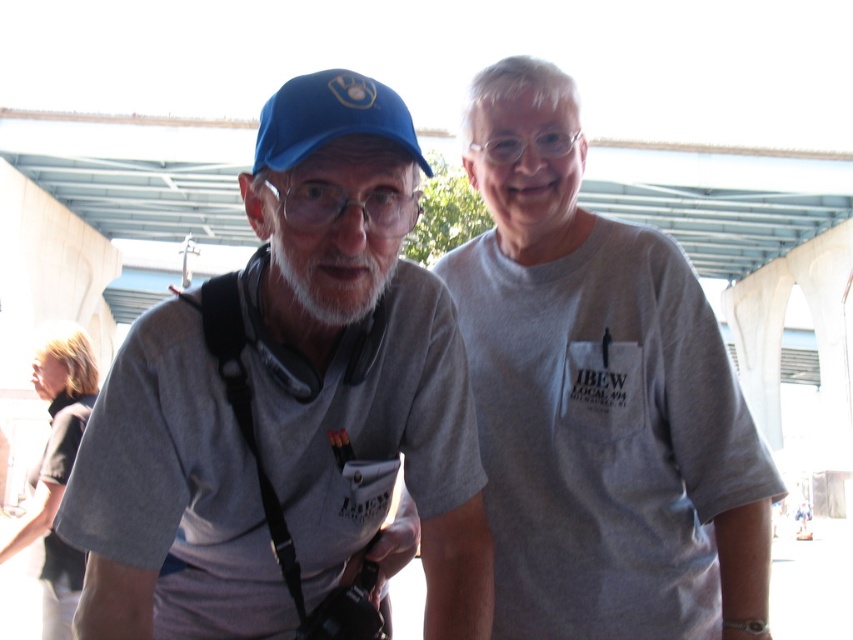
Question: Can you confirm if matte gray t-shirt at left is smaller than transparent plastic goggles at center?

Choices:
 (A) no
 (B) yes

Answer: (A)

Question: Which object appears farthest from the camera in this image?

Choices:
 (A) matte gray t-shirt at left
 (B) transparent plastic goggles at center
 (C) dark gray shirt at lower left

Answer: (C)

Question: Which of the following is the farthest from the observer?

Choices:
 (A) (314, 104)
 (B) (393, 204)
 (C) (65, 516)

Answer: (B)

Question: Does gray cotton t-shirt at center have a greater width compared to whitehairbeard at center?

Choices:
 (A) yes
 (B) no

Answer: (A)

Question: Which point is farther to the camera?

Choices:
 (A) gray cotton t-shirt at center
 (B) dark gray shirt at lower left

Answer: (B)

Question: Is gray cotton t-shirt at center positioned behind transparent plastic goggles at center?

Choices:
 (A) yes
 (B) no

Answer: (A)